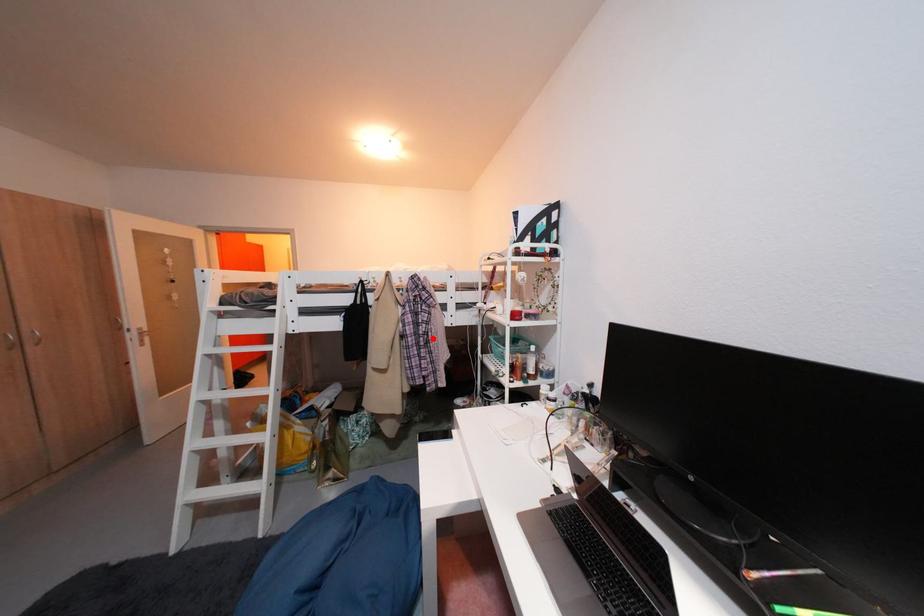
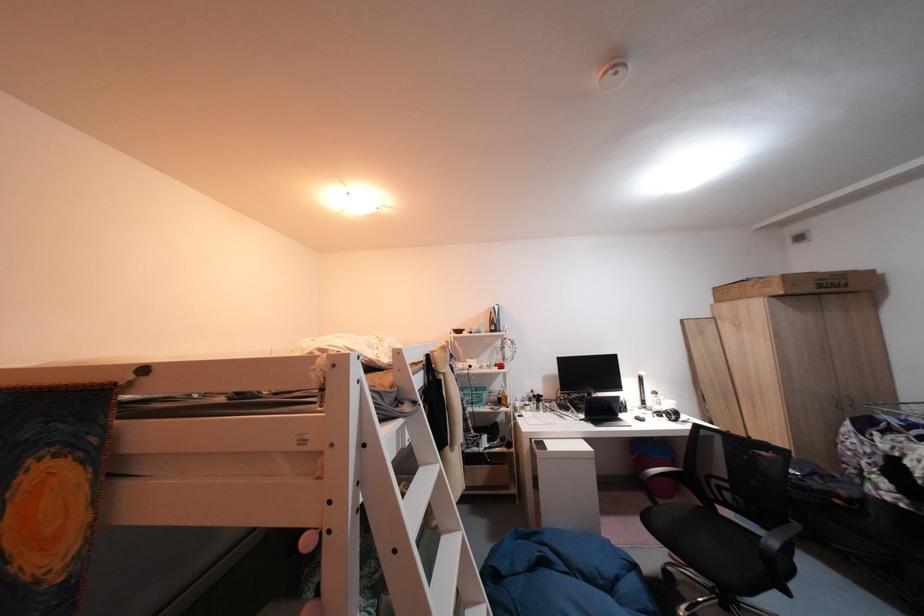
Locate, in the second image, the point that corresponds to the highlighted location in the first image.

(475, 400)